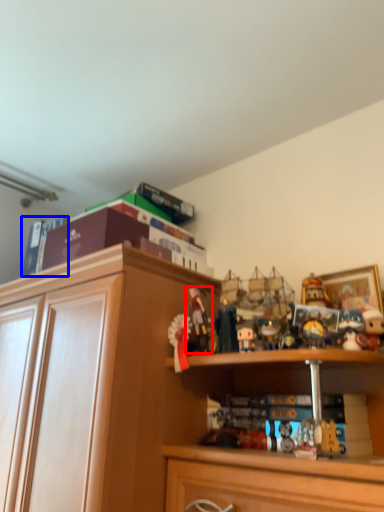
Question: Among these objects, which one is nearest to the camera, toy (highlighted by a red box) or book (highlighted by a blue box)?

Choices:
 (A) toy
 (B) book

Answer: (A)